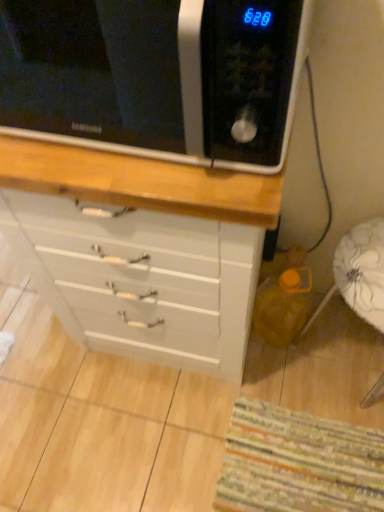
Describe the element at coordinates (143, 250) in the screenshot. The image size is (384, 512). I see `white glossy chest of drawers at center` at that location.

This screenshot has height=512, width=384. Describe the element at coordinates (155, 76) in the screenshot. I see `black matte microwave at upper left` at that location.

The image size is (384, 512). In order to click on white fabric swivel chair at lower right in this screenshot , I will do `click(359, 274)`.

Locate an element on the screen. This screenshot has height=512, width=384. white glossy chest of drawers at center is located at coordinates (143, 250).

Is white fabric swivel chair at lower right wider or thinner than black matte microwave at upper left?

In the image, white fabric swivel chair at lower right appears to be more narrow than black matte microwave at upper left.

Is white fabric swivel chair at lower right facing towards black matte microwave at upper left?

No.

What's the angular difference between white fabric swivel chair at lower right and black matte microwave at upper left's facing directions?

1.06 degrees.

Measure the distance between black matte microwave at upper left and striped fabric mat at lower right.

They are 4.37 feet apart.

Which is closer, (x=174, y=81) or (x=218, y=492)?

Clearly, point (x=174, y=81) is more distant from the camera than point (x=218, y=492).

From a real-world perspective, is black matte microwave at upper left positioned under striped fabric mat at lower right based on gravity?

No.

Does black matte microwave at upper left turn towards striped fabric mat at lower right?

No, black matte microwave at upper left is not facing towards striped fabric mat at lower right.

At what (x,y) coordinates should I click in order to perform the action: click on chest of drawers in front of the striped fabric mat at lower right. Please return your answer as a coordinate pair (x, y). Looking at the image, I should click on (143, 250).

Considering the sizes of striped fabric mat at lower right and white glossy chest of drawers at center in the image, is striped fabric mat at lower right bigger or smaller than white glossy chest of drawers at center?

In the image, striped fabric mat at lower right appears to be smaller than white glossy chest of drawers at center.

Is striped fabric mat at lower right positioned with its back to white glossy chest of drawers at center?

No, white glossy chest of drawers at center is not at the back of striped fabric mat at lower right.

Considering the relative positions of striped fabric mat at lower right and white glossy chest of drawers at center in the image provided, is striped fabric mat at lower right behind white glossy chest of drawers at center?

That is True.

The width and height of the screenshot is (384, 512). Identify the location of swivel chair lying behind the white glossy chest of drawers at center. (359, 274).

Are white glossy chest of drawers at center and white fabric swivel chair at lower right making contact?

white glossy chest of drawers at center and white fabric swivel chair at lower right are not in contact.

Which is behind, point (45, 178) or point (367, 254)?

The point (367, 254) is farther.

Is white glossy chest of drawers at center inside or outside of white fabric swivel chair at lower right?

white glossy chest of drawers at center exists outside the volume of white fabric swivel chair at lower right.

Considering the relative sizes of striped fabric mat at lower right and white fabric swivel chair at lower right in the image provided, is striped fabric mat at lower right wider than white fabric swivel chair at lower right?

Correct, the width of striped fabric mat at lower right exceeds that of white fabric swivel chair at lower right.

Is striped fabric mat at lower right oriented away from white fabric swivel chair at lower right?

No, white fabric swivel chair at lower right is not at the back of striped fabric mat at lower right.

From the image's perspective, is striped fabric mat at lower right on top of white fabric swivel chair at lower right?

No.

How many degrees apart are the facing directions of striped fabric mat at lower right and white fabric swivel chair at lower right?

90 degrees separate the facing orientations of striped fabric mat at lower right and white fabric swivel chair at lower right.

From a real-world perspective, who is located higher, striped fabric mat at lower right or black matte microwave at upper left?

In real-world perspective, black matte microwave at upper left is above.

Is striped fabric mat at lower right not inside black matte microwave at upper left?

Indeed, striped fabric mat at lower right is completely outside black matte microwave at upper left.

Is striped fabric mat at lower right bigger or smaller than black matte microwave at upper left?

Considering their sizes, striped fabric mat at lower right takes up less space than black matte microwave at upper left.

Where is `chest of drawers lying on the left of black matte microwave at upper left`? The image size is (384, 512). chest of drawers lying on the left of black matte microwave at upper left is located at coordinates pyautogui.click(x=143, y=250).

Between point (15, 41) and point (229, 216), which one is positioned in front?

The point (229, 216) is more forward.

Can you tell me how much black matte microwave at upper left and white glossy chest of drawers at center differ in facing direction?

The facing directions of black matte microwave at upper left and white glossy chest of drawers at center are 1.52 degrees apart.

Is white glossy chest of drawers at center a part of black matte microwave at upper left?

No, white glossy chest of drawers at center is not a part of black matte microwave at upper left.

The width and height of the screenshot is (384, 512). What are the coordinates of `swivel chair on the right of black matte microwave at upper left` in the screenshot? It's located at (359, 274).

Where is `mat that is below the black matte microwave at upper left (from the image's perspective)`? The image size is (384, 512). mat that is below the black matte microwave at upper left (from the image's perspective) is located at coordinates (298, 462).

Considering their positions, is black matte microwave at upper left positioned closer to white glossy chest of drawers at center than striped fabric mat at lower right?

striped fabric mat at lower right lies closer to white glossy chest of drawers at center than the other object.

From the image, which object appears to be nearer to white fabric swivel chair at lower right, striped fabric mat at lower right or black matte microwave at upper left?

Based on the image, striped fabric mat at lower right appears to be nearer to white fabric swivel chair at lower right.

Based on the photo, when comparing their distances from black matte microwave at upper left, does striped fabric mat at lower right or white fabric swivel chair at lower right seem further?

Among the two, striped fabric mat at lower right is located further to black matte microwave at upper left.

Which object lies nearer to the anchor point black matte microwave at upper left, white fabric swivel chair at lower right or white glossy chest of drawers at center?

white glossy chest of drawers at center is closer to black matte microwave at upper left.

Considering their positions, is striped fabric mat at lower right positioned closer to white fabric swivel chair at lower right than white glossy chest of drawers at center?

white glossy chest of drawers at center lies closer to white fabric swivel chair at lower right than the other object.

Considering their positions, is black matte microwave at upper left positioned closer to striped fabric mat at lower right than white glossy chest of drawers at center?

white glossy chest of drawers at center is closer to striped fabric mat at lower right.

When comparing their distances from black matte microwave at upper left, does white glossy chest of drawers at center or striped fabric mat at lower right seem closer?

Among the two, white glossy chest of drawers at center is located nearer to black matte microwave at upper left.

When comparing their distances from white fabric swivel chair at lower right, does black matte microwave at upper left or striped fabric mat at lower right seem further?

black matte microwave at upper left is further to white fabric swivel chair at lower right.

Locate an element on the screen. microwave oven between white glossy chest of drawers at center and white fabric swivel chair at lower right is located at coordinates [155, 76].

This screenshot has width=384, height=512. Identify the location of swivel chair between black matte microwave at upper left and striped fabric mat at lower right in the vertical direction. (359, 274).

Where is `swivel chair between white glossy chest of drawers at center and striped fabric mat at lower right in the vertical direction`? swivel chair between white glossy chest of drawers at center and striped fabric mat at lower right in the vertical direction is located at coordinates (359, 274).

I want to click on chest of drawers between black matte microwave at upper left and striped fabric mat at lower right from top to bottom, so click(143, 250).